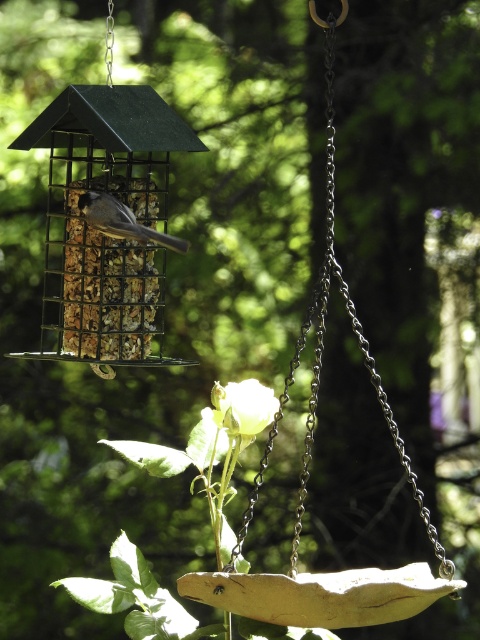
Is white matte rose at center bigger than gray matte bird at center?

Incorrect, white matte rose at center is not larger than gray matte bird at center.

Which of these two, white matte rose at center or gray matte bird at center, stands taller?

With more height is gray matte bird at center.

Which is behind, point (226, 387) or point (93, 225)?

The point (93, 225) is behind.

The image size is (480, 640). Identify the location of white matte rose at center. (243, 406).

Does metallic silver chain at center appear under gray matte bird at center?

Correct, metallic silver chain at center is located below gray matte bird at center.

Is the position of metallic silver chain at center more distant than that of gray matte bird at center?

No.

Between point (312, 388) and point (167, 236), which one is positioned in front?

Point (312, 388)

Image resolution: width=480 pixels, height=640 pixels. Identify the location of metallic silver chain at center. (319, 292).

Who is lower down, metallic silver chain at center or white matte rose at center?

Positioned lower is white matte rose at center.

Does metallic silver chain at center appear over white matte rose at center?

Correct, metallic silver chain at center is located above white matte rose at center.

Does point (316, 385) come farther from viewer compared to point (260, 394)?

No.

Where is `metallic silver chain at center`? This screenshot has width=480, height=640. metallic silver chain at center is located at coordinates (319, 292).